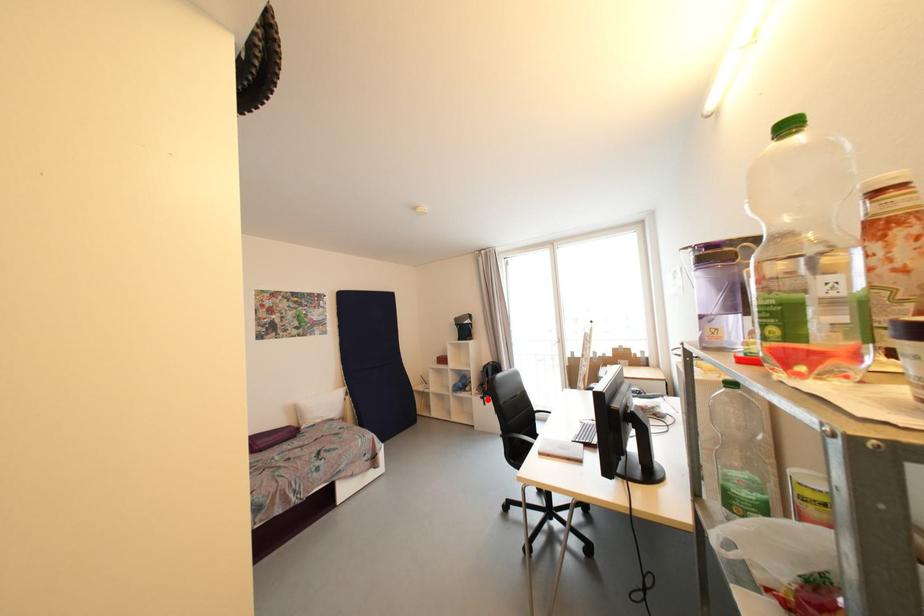
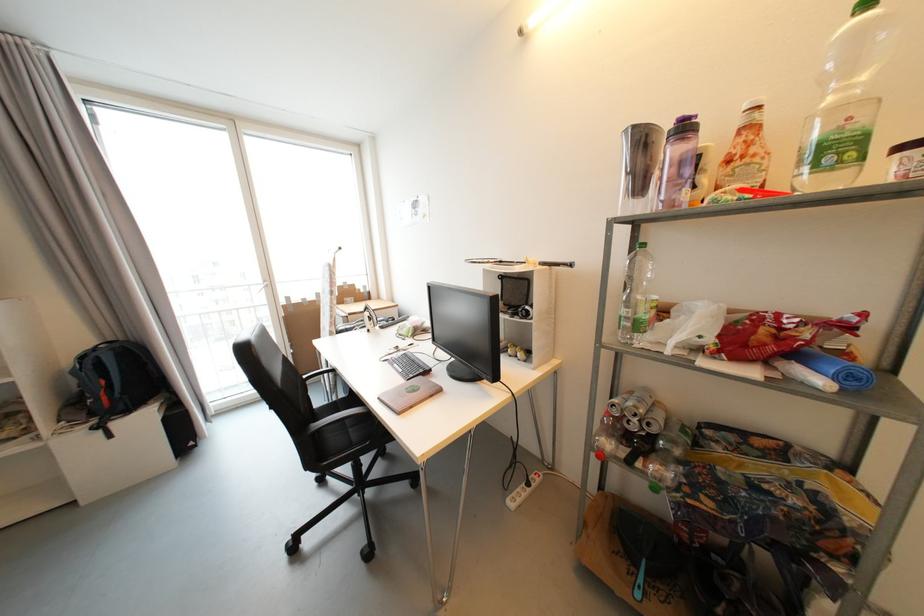
Locate, in the second image, the point that corresponds to the highlighted location in the first image.

(104, 429)